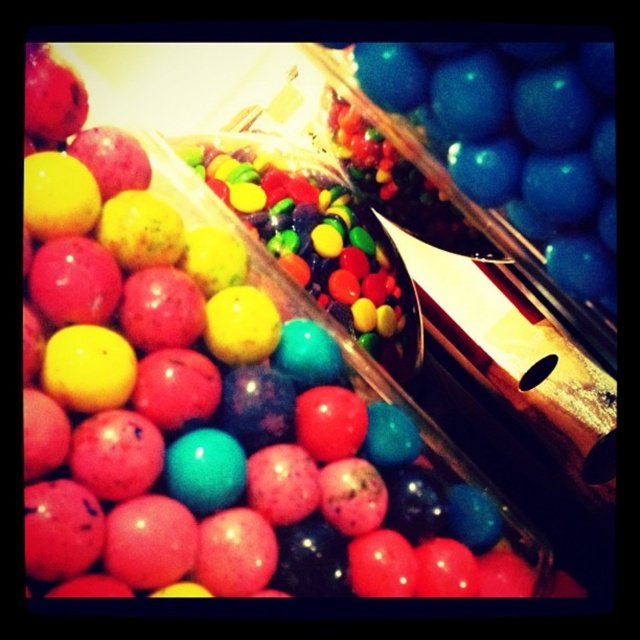
Can you confirm if blue glossy gumballs at upper right is positioned to the right of shiny multicolored candies at center?

Yes, blue glossy gumballs at upper right is to the right of shiny multicolored candies at center.

Who is positioned more to the right, blue glossy gumballs at upper right or shiny multicolored candies at center?

Positioned to the right is blue glossy gumballs at upper right.

The width and height of the screenshot is (640, 640). Find the location of `blue glossy gumballs at upper right`. blue glossy gumballs at upper right is located at coordinates (518, 140).